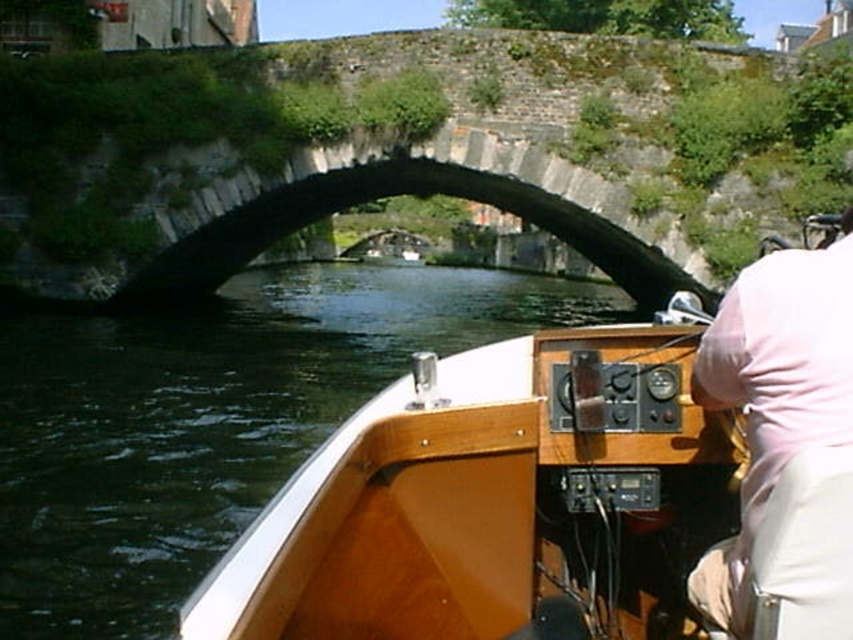
You are on a canal boat and need to navigate under a stone bridge. You see two points marked on the bridge structure. From your position inside the boat, which point is closer to you? The points are point [575,204] and point [746,378].

Point [575,204] is closer to you because it is further to the viewer than point [746,378], meaning it is nearer in perspective.

You are standing on the wooden boat at center and want to hand a flower to the person wearing the pink fabric shirt at right. Since you can only reach forward, will you be able to reach them?

The wooden boat at center is further to the viewer than pink fabric shirt at right, so the person is behind you. Since you can only reach forward, you won me not be able to reach them.

You are standing on the point at coordinates (622, 394) on the boat. The bridge is directly ahead. If you walk straight towards the bridge, will you reach the bridge before reaching the edge of the boat?

The distance between the point at coordinates (622, 394) and the bridge is 17.04 feet, which is farther than the distance to the edge of the boat. Therefore, you will reach the edge of the boat before the bridge.